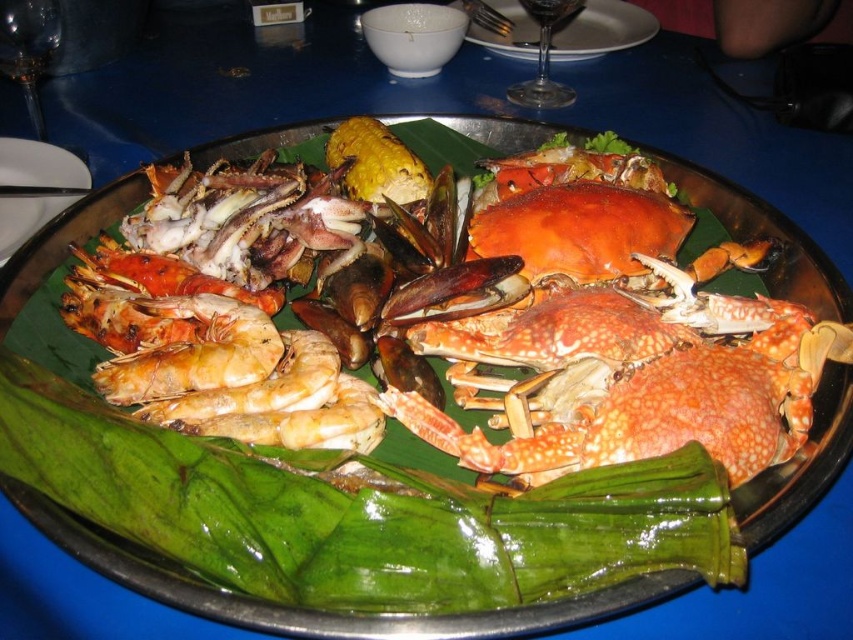
You are planning to serve a small dessert on the white glossy plate at upper left. The dessert requires a plate that is larger than the transparent glass wine glass at upper right. Will the plate be suitable?

The white glossy plate at upper left is smaller than the transparent glass wine glass at upper right, so it is not suitable for the dessert that requires a plate larger than the wine glass.

You are a food critic standing 1 meter away from the white glossy plate at upper left. Can you reach the plate without moving your position?

The distance between you and the white glossy plate at upper left is 88.63 centimeters, which is less than 1 meter. Therefore, you can reach the plate without moving your position.

You are a food critic inspecting a seafood platter. You notice two types of seafood at the center of the platter. Which one is closer to you, the shiny golden prawns at center or the white matte shrimp at center?

The shiny golden prawns at center are closer to you because the white matte shrimp at center is behind them.